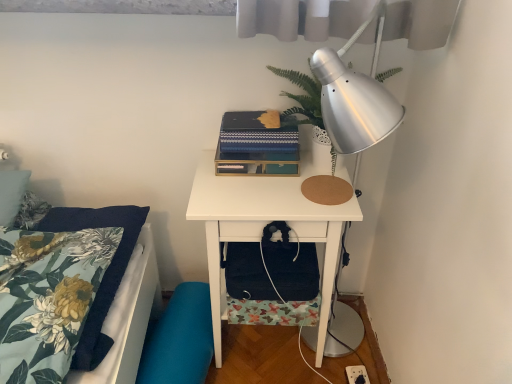
Find the location of `vacant space in front of blue textured book at center`. vacant space in front of blue textured book at center is located at coordinates (249, 194).